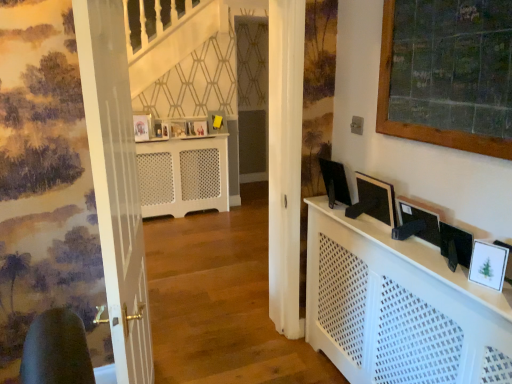
You are a GUI agent. You are given a task and a screenshot of the screen. Output one action in this format:
    pyautogui.click(x=<x>, y=<y>)
    Task: Click on the vacant area that lies in front of matte black monitor at right, which is the 2th computer monitor in back-to-front order
    Image resolution: width=512 pixels, height=384 pixels.
    Given the screenshot: What is the action you would take?
    pyautogui.click(x=390, y=235)